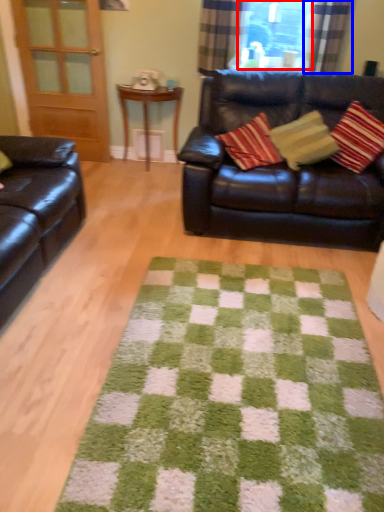
Question: Which point is further to the camera, window screen (highlighted by a red box) or curtain (highlighted by a blue box)?

Choices:
 (A) window screen
 (B) curtain

Answer: (A)